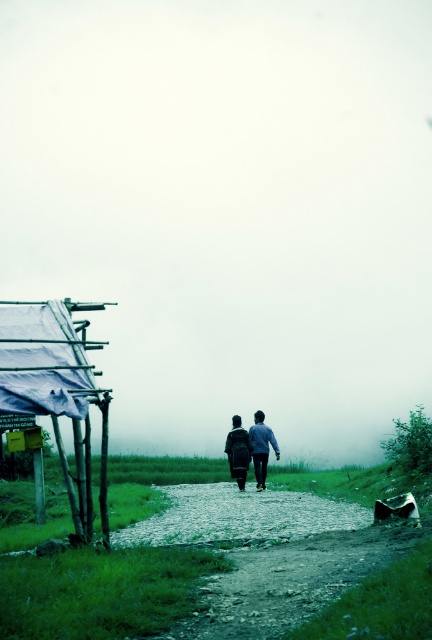
From the picture: You are a hiker planning to carry both the matte black backpack at center and the dark blue fabric jacket at center on your trip. Based on their sizes, which item should you place first into your luggage to ensure both fit properly?

The matte black backpack at center is bigger than the dark blue fabric jacket at center, so you should place the matte black backpack at center first to make space for the smaller jacket.

You are a photographer trying to capture the two points in the scene. Which point, point [242,456] or point [238,448], appears closer to your camera lens?

Point [242,456] is closer to the camera than point [238,448].

You are a hiker planning to carry both the matte black backpack at center and the dark blue fabric jacket at center. Based on their sizes, can you determine which one you should place first in your luggage to ensure they both fit properly?

The matte black backpack at center might be wider than the dark blue fabric jacket at center, so you should place the matte black backpack at center first to accommodate its width before adding the dark blue fabric jacket at center.